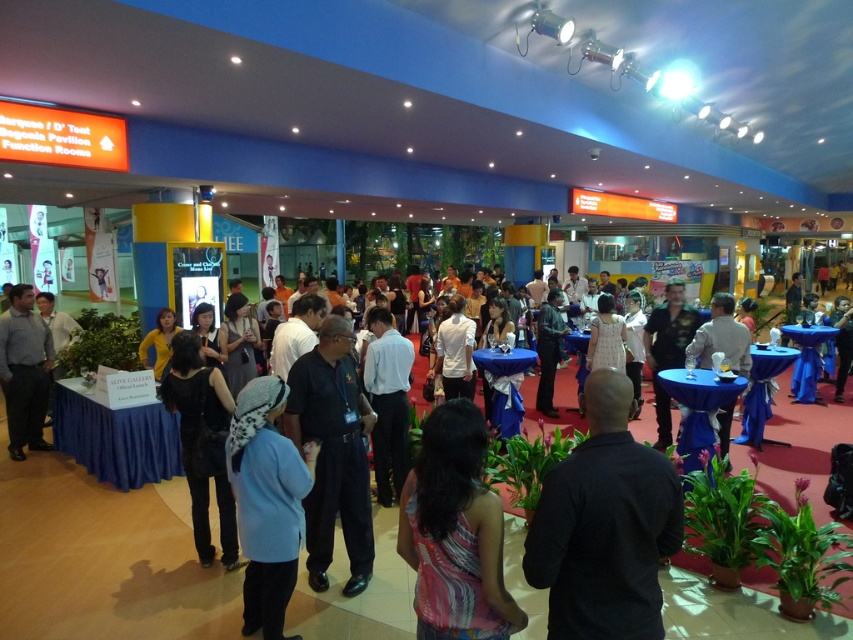
Identify the location of printed silk blouse at center. (456, 532).

Does printed silk blouse at center have a larger size compared to blue woolen hat at lower left?

No.

The height and width of the screenshot is (640, 853). What are the coordinates of `printed silk blouse at center` in the screenshot? It's located at (456, 532).

Identify the location of printed silk blouse at center. The image size is (853, 640). pos(456,532).

Does blue woolen hat at lower left appear on the right side of black matte dress at lower left?

Correct, you'll find blue woolen hat at lower left to the right of black matte dress at lower left.

Identify the location of blue woolen hat at lower left. The width and height of the screenshot is (853, 640). (265, 502).

How much distance is there between black matte shirt at center and printed silk blouse at center?

black matte shirt at center and printed silk blouse at center are 11.65 inches apart.

Which of these two, black matte shirt at center or printed silk blouse at center, stands shorter?

printed silk blouse at center is shorter.

Is point (544, 497) positioned behind point (466, 596)?

That is False.

At what (x,y) coordinates should I click in order to perform the action: click on black matte shirt at center. Please return your answer as a coordinate pair (x, y). The height and width of the screenshot is (640, 853). Looking at the image, I should click on (604, 525).